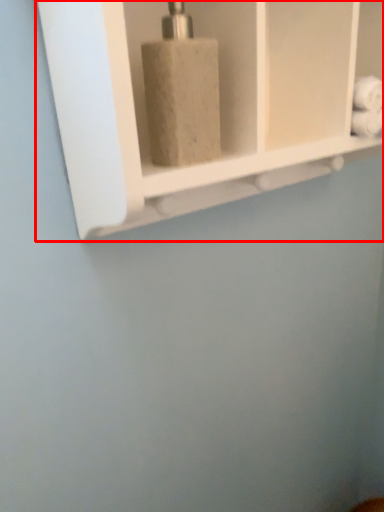
Question: In this image, where is shelf (annotated by the red box) located relative to soap dispenser?

Choices:
 (A) right
 (B) left

Answer: (A)